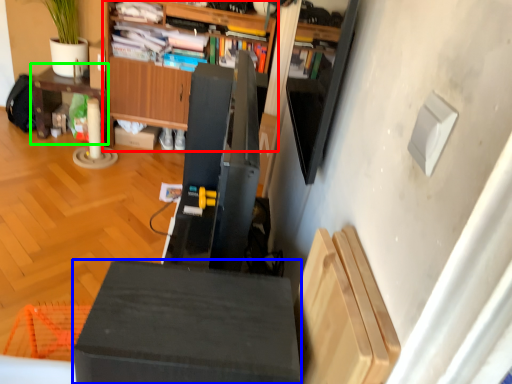
Question: Which object is positioned farthest from cabinetry (highlighted by a red box)? Select from furniture (highlighted by a blue box) and table (highlighted by a green box).

Choices:
 (A) furniture
 (B) table

Answer: (A)